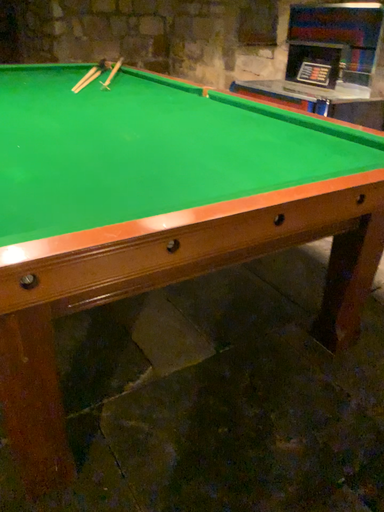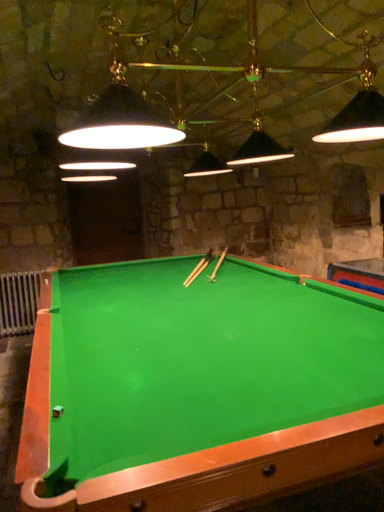
Question: Which way did the camera rotate in the video?

Choices:
 (A) rotated upward
 (B) rotated downward

Answer: (A)